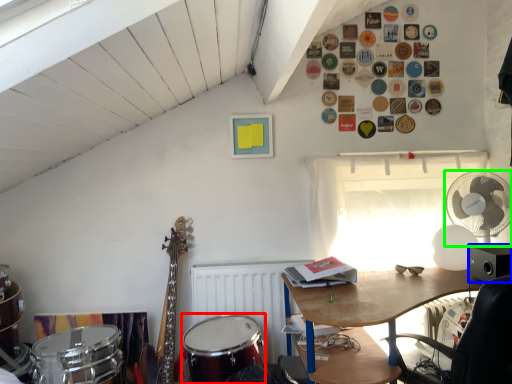
Question: Estimate the real-world distances between objects in this image. Which object is closer to drum (highlighted by a red box), loudspeaker (highlighted by a blue box) or mechanical fan (highlighted by a green box)?

Choices:
 (A) loudspeaker
 (B) mechanical fan

Answer: (A)